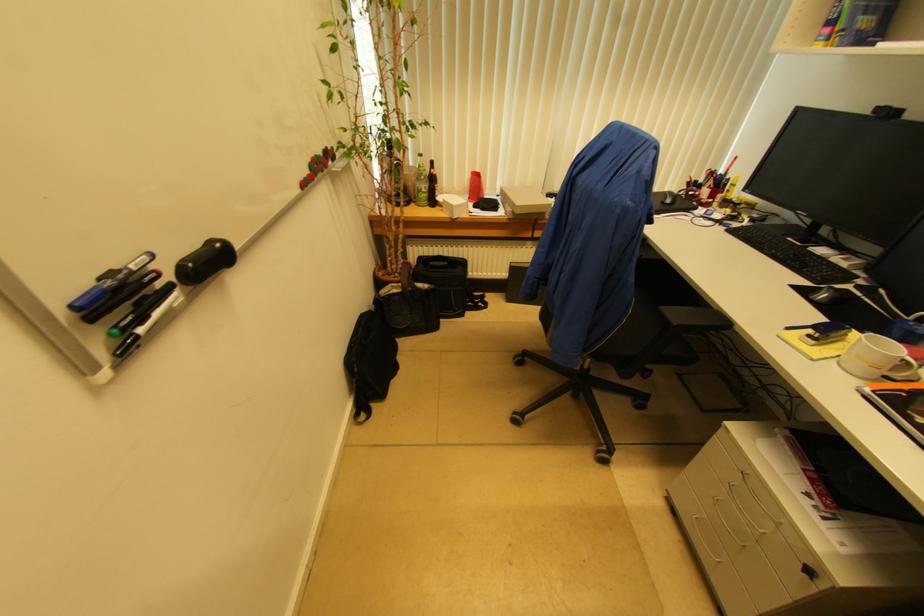
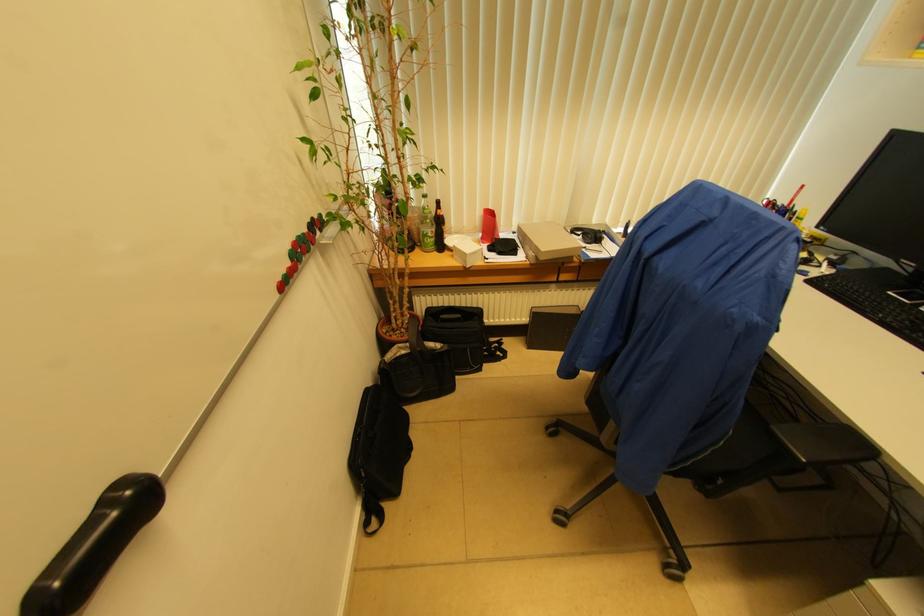
Question: The first image is from the beginning of the video and the second image is from the end. How did the camera likely rotate when shooting the video?

Choices:
 (A) Left
 (B) Right
 (C) Up
 (D) Down

Answer: (B)